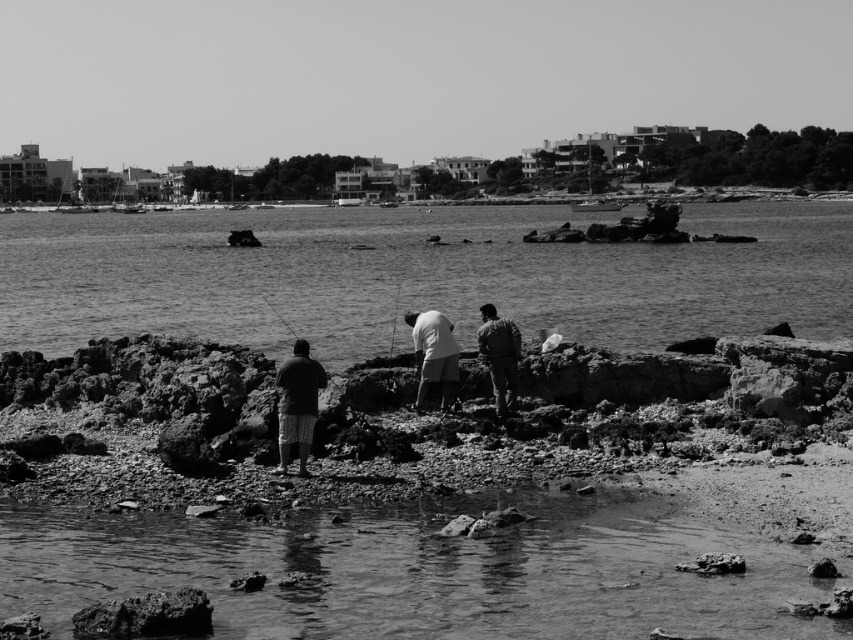
Is point (267, 262) less distant than point (428, 330)?

No, it is not.

How much distance is there between smooth water at center and smooth white shirt at center?

The distance of smooth water at center from smooth white shirt at center is 311.85 feet.

Find the location of a particular element. This screenshot has width=853, height=640. smooth water at center is located at coordinates (415, 276).

At what (x,y) coordinates should I click in order to perform the action: click on smooth water at center. Please return your answer as a coordinate pair (x, y). Looking at the image, I should click on (415, 276).

Can you confirm if smooth white shirt at center is thinner than smooth plastic fishing pole at center?

No.

Is smooth white shirt at center to the left of smooth plastic fishing pole at center from the viewer's perspective?

In fact, smooth white shirt at center is to the right of smooth plastic fishing pole at center.

Which is behind, point (440, 401) or point (399, 294)?

Point (399, 294)

Find the location of `smooth white shirt at center`. smooth white shirt at center is located at coordinates (433, 355).

Which of these two, striped shorts at center or smooth plastic fishing pole at center, stands taller?

smooth plastic fishing pole at center

Does striped shorts at center have a greater height compared to smooth plastic fishing pole at center?

Incorrect, striped shorts at center's height is not larger of smooth plastic fishing pole at center's.

Who is more forward, [299,403] or [387,348]?

Point [299,403] is more forward.

The image size is (853, 640). Find the location of `striped shorts at center`. striped shorts at center is located at coordinates (297, 403).